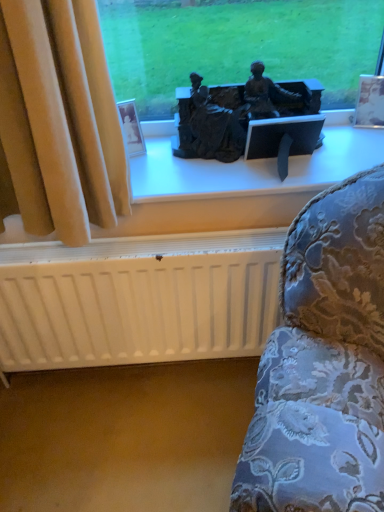
At what (x,y) coordinates should I click in order to perform the action: click on blank space situated above matte black statue at center (from a real-world perspective). Please return your answer as a coordinate pair (x, y). Looking at the image, I should click on (249, 157).